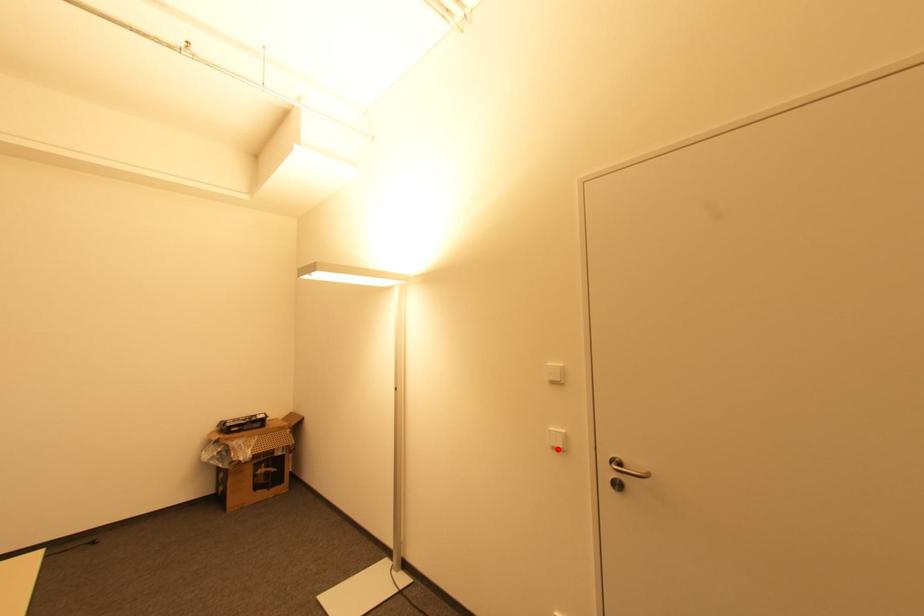
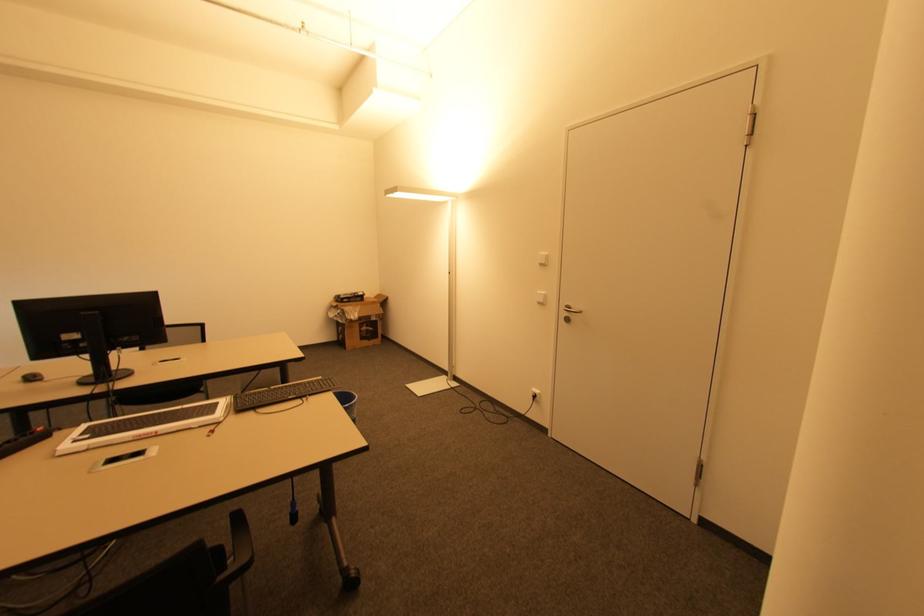
Find the pixel in the second image that matches the highlighted location in the first image.

(541, 302)